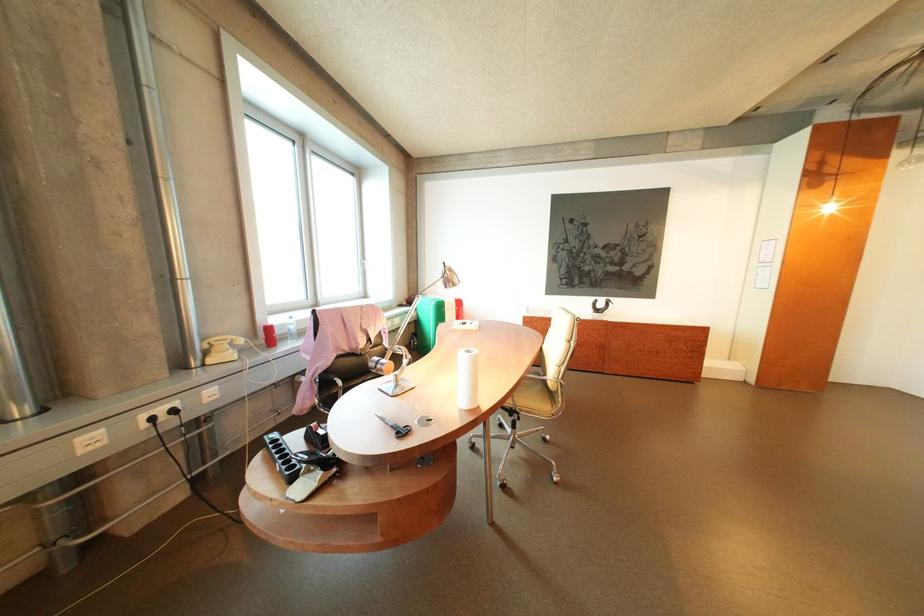
The width and height of the screenshot is (924, 616). Identify the location of black chair armrest. (334, 379).